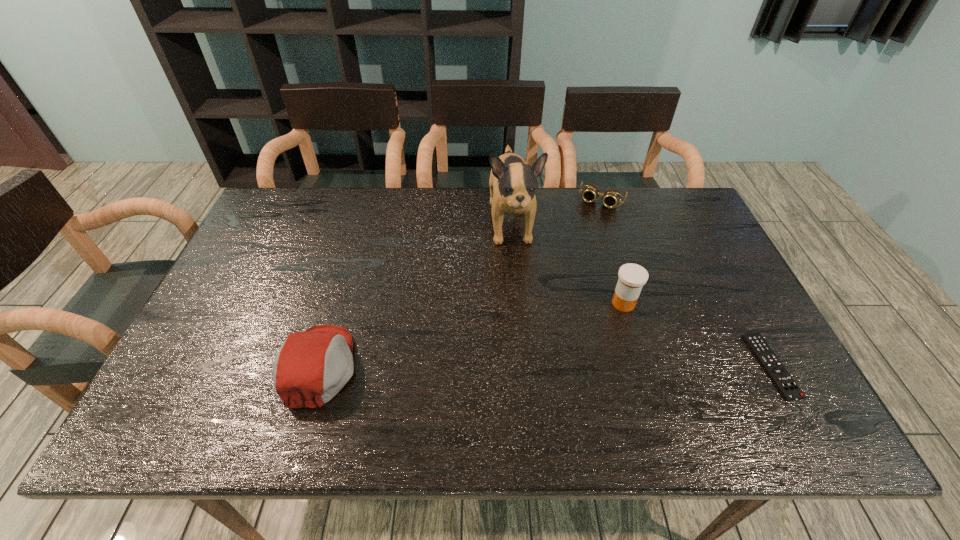
Locate an element on the screen. This screenshot has width=960, height=540. vacant space in between the goggles and the shortest object is located at coordinates (686, 284).

The width and height of the screenshot is (960, 540). In order to click on vacant space that is in between the puppy and the third nearest object in this screenshot , I will do `click(567, 264)`.

What are the coordinates of `empty space between the rightmost object and the leftmost object` in the screenshot? It's located at (545, 366).

Where is `free space between the puppy and the fourth tallest object`? free space between the puppy and the fourth tallest object is located at coordinates 557,212.

You are a GUI agent. You are given a task and a screenshot of the screen. Output one action in this format:
    pyautogui.click(x=<x>, y=<y>)
    Task: Click on the vacant point located between the cap and the shortest object
    
    Given the screenshot: What is the action you would take?
    pyautogui.click(x=545, y=366)

Identify the location of free space between the medicine and the second shortest object. (612, 252).

What are the coordinates of `vacant space that's between the puppy and the second shortest object` in the screenshot? It's located at point(557,212).

Locate an element on the screen. The image size is (960, 540). unoccupied position between the shortest object and the goggles is located at coordinates (686, 284).

Image resolution: width=960 pixels, height=540 pixels. What are the coordinates of `vacant point located between the cap and the medicine` in the screenshot? It's located at (471, 335).

Find the location of a particular element. unoccupied position between the remote control and the fourth tallest object is located at coordinates (686, 284).